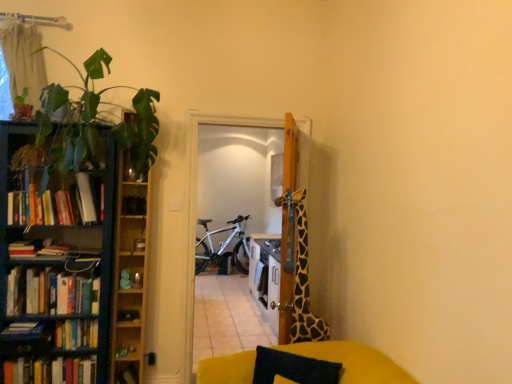
Locate an element on the screen. This screenshot has height=384, width=512. free space above hardcover book at left, which is counted as the fourth book, starting from the bottom (from a real-world perspective) is located at coordinates (28, 325).